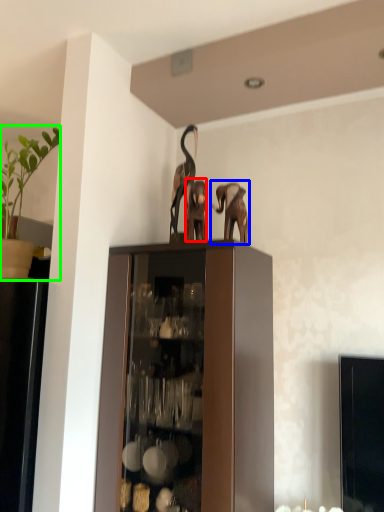
Question: Estimate the real-world distances between objects in this image. Which object is closer to animal (highlighted by a red box), elephant (highlighted by a blue box) or houseplant (highlighted by a green box)?

Choices:
 (A) elephant
 (B) houseplant

Answer: (A)